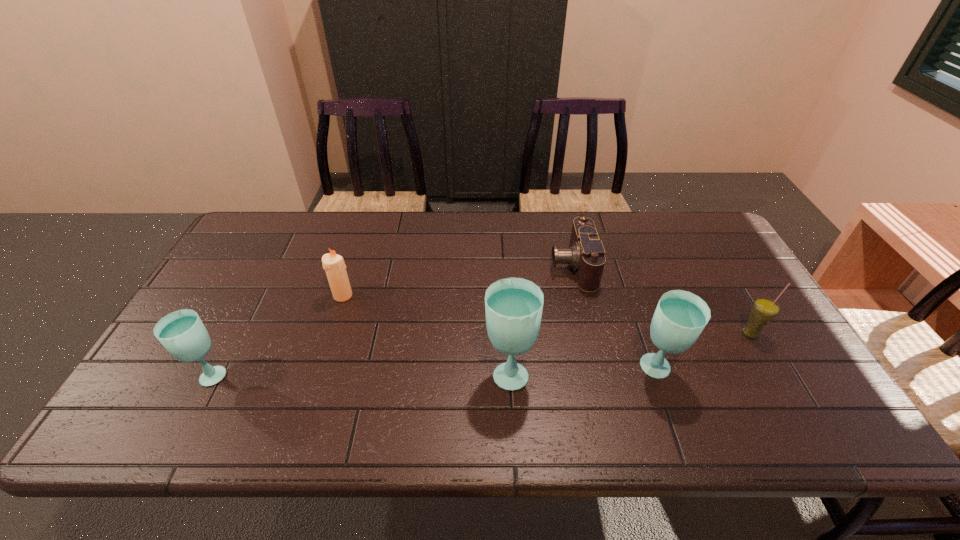
This screenshot has width=960, height=540. Identify the location of the shortest glass. (182, 333).

The width and height of the screenshot is (960, 540). In order to click on the leftmost glass in this screenshot , I will do `click(182, 333)`.

Where is `the second glass from left to right`? The image size is (960, 540). the second glass from left to right is located at coordinates (513, 306).

Locate an element on the screen. the second object from right to left is located at coordinates (680, 317).

Locate an element on the screen. The image size is (960, 540). the second tallest object is located at coordinates (680, 317).

Where is `the third farthest object`? This screenshot has height=540, width=960. the third farthest object is located at coordinates click(764, 310).

The height and width of the screenshot is (540, 960). Identify the location of straw for drinking. click(764, 310).

The height and width of the screenshot is (540, 960). I want to click on camera, so click(x=586, y=254).

The width and height of the screenshot is (960, 540). I want to click on the shortest object, so click(586, 254).

Where is `the second object from left to right`? the second object from left to right is located at coordinates (333, 264).